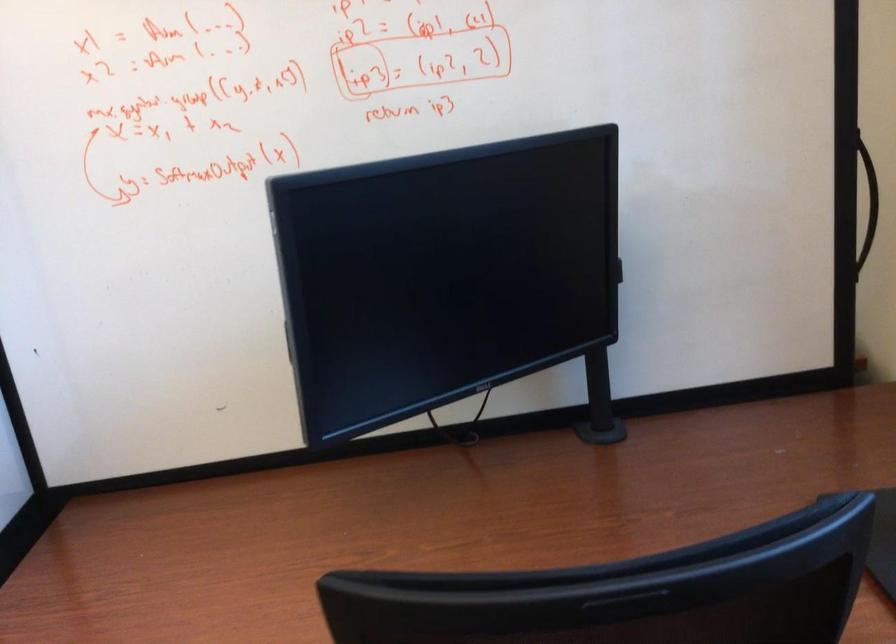
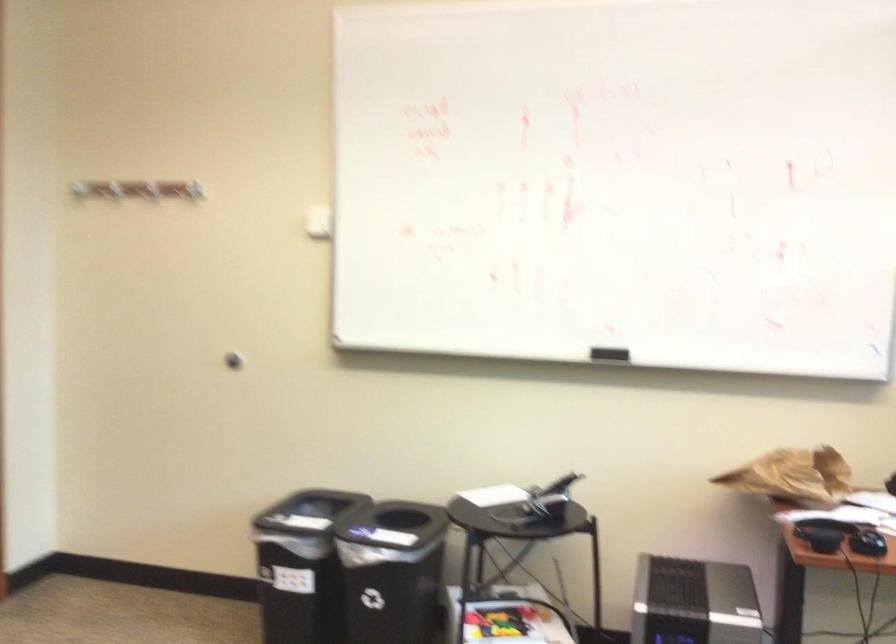
Which direction would the cameraman need to move to produce the second image?

The cameraman walked toward left, forward.